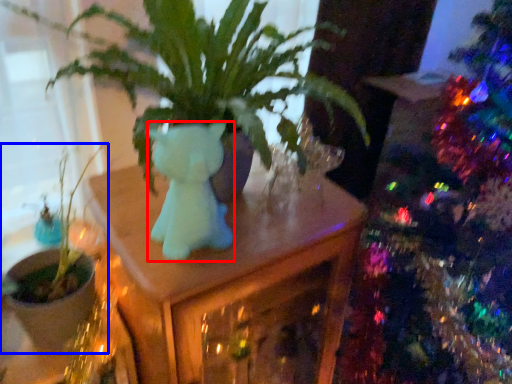
Question: Which of the following is the closest to the observer, animal (highlighted by a red box) or houseplant (highlighted by a blue box)?

Choices:
 (A) animal
 (B) houseplant

Answer: (A)